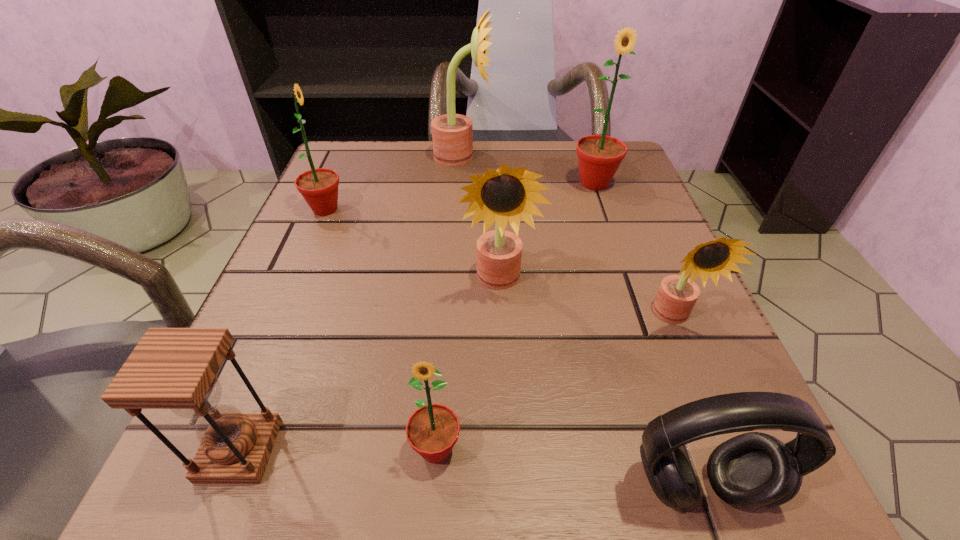
The height and width of the screenshot is (540, 960). Identify the location of vacant space that satisfies the following two spatial constraints: 1. on the face of the biggest yellow sunflower; 2. on the front side of the hourglass. (445, 450).